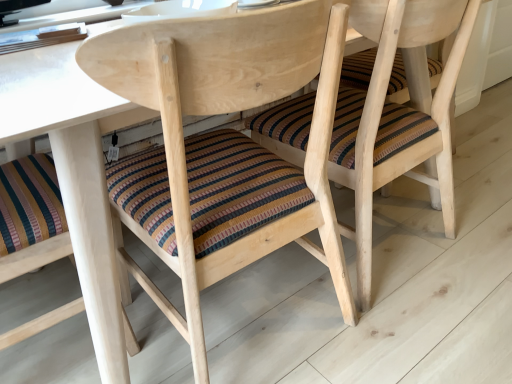
The width and height of the screenshot is (512, 384). Identify the location of free space in front of striped fabric cushion at center, placed as the 1th chair when sorted from right to left. (422, 325).